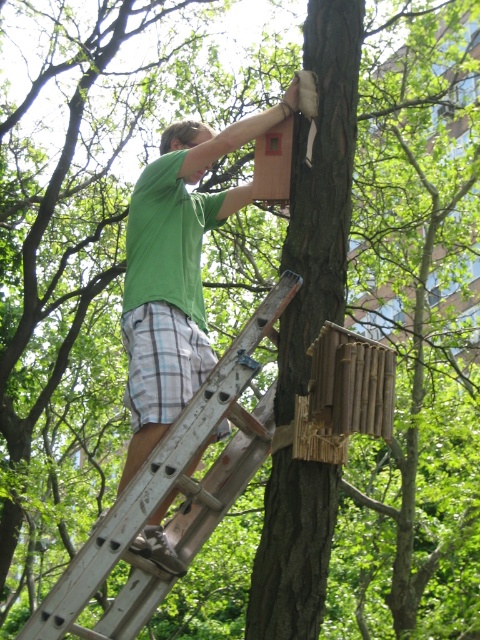
Question: Is green matte shirt at upper center closer to camera compared to natural wood birdhouse at center?

Choices:
 (A) yes
 (B) no

Answer: (B)

Question: Which point is closer to the camera taking this photo?

Choices:
 (A) (158, 362)
 (B) (180, 440)

Answer: (B)

Question: Among these points, which one is farthest from the camera?

Choices:
 (A) (291, 115)
 (B) (348, 419)

Answer: (A)

Question: Among these points, which one is nearest to the camera?

Choices:
 (A) (46, 604)
 (B) (354, 429)
 (C) (261, 148)
 (D) (203, 301)

Answer: (A)

Question: Can you confirm if green matte shirt at upper center is wider than wooden ladder at center?

Choices:
 (A) yes
 (B) no

Answer: (B)

Question: Is green matte shirt at upper center smaller than wooden birdhouse at upper center?

Choices:
 (A) yes
 (B) no

Answer: (B)